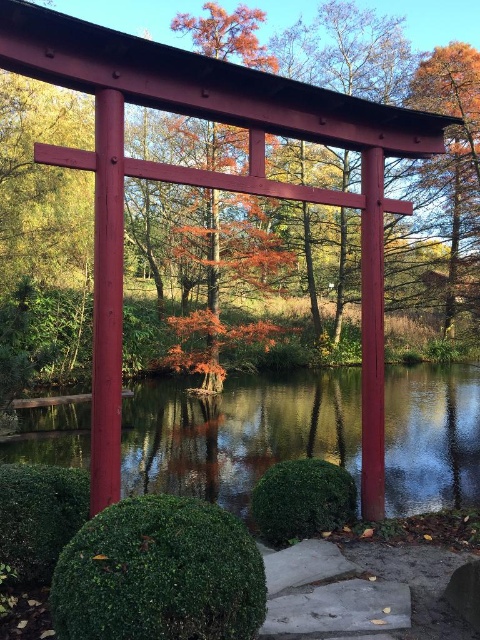
You are standing at point A at point [394,45] and want to walk to point B, which is 31.09 meters away. Is there a clear path between the two points, considering the torii gate and the pond?

The torii gate and the pond are located between point A at point [394,45] and point B, which is 31.09 meters away. However, the scene description mentions the torii gate is in the foreground and the pond is in the background. Since the torii gate is in the foreground, it might block the path directly to the pond. Therefore, there might not be a clear path between the two points without navigating around the gate or the pond.